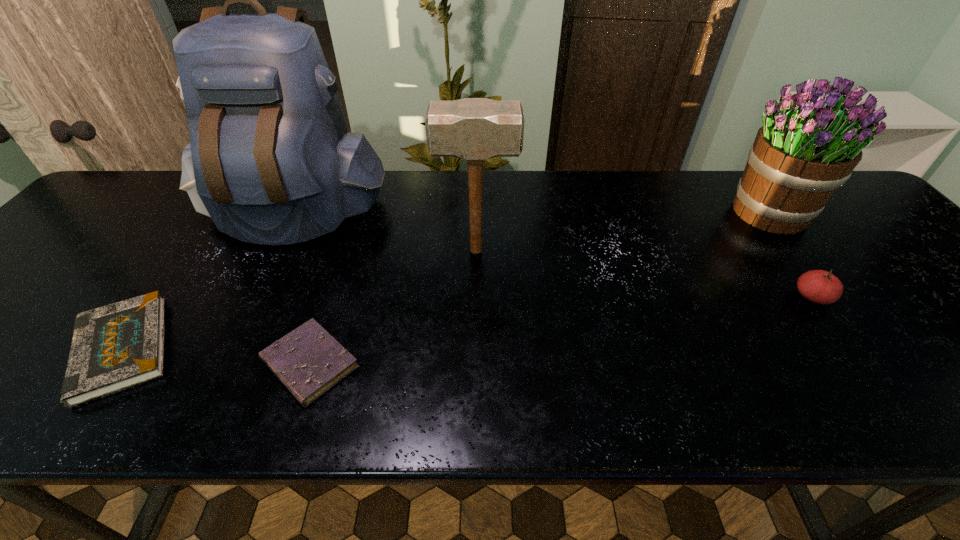
I want to click on the tallest object, so click(270, 160).

Identify the location of the third object from right to left. (474, 129).

Image resolution: width=960 pixels, height=540 pixels. I want to click on bouquet, so click(810, 142).

Image resolution: width=960 pixels, height=540 pixels. I want to click on tomato, so tap(819, 286).

In order to click on notebook in this screenshot , I will do `click(115, 347)`.

Locate an element on the screen. the shortest object is located at coordinates (308, 361).

Where is `free space located 0.400m at the front pocket of the backpack`? The height and width of the screenshot is (540, 960). free space located 0.400m at the front pocket of the backpack is located at coordinates (201, 396).

Find the location of a particular element. The height and width of the screenshot is (540, 960). vacant region located 0.210m on the striking face of the fourth object from left to right is located at coordinates (597, 251).

Where is `free space located on the left of the bouquet`? free space located on the left of the bouquet is located at coordinates (652, 213).

Image resolution: width=960 pixels, height=540 pixels. I want to click on blank space located on the right of the tomato, so click(893, 297).